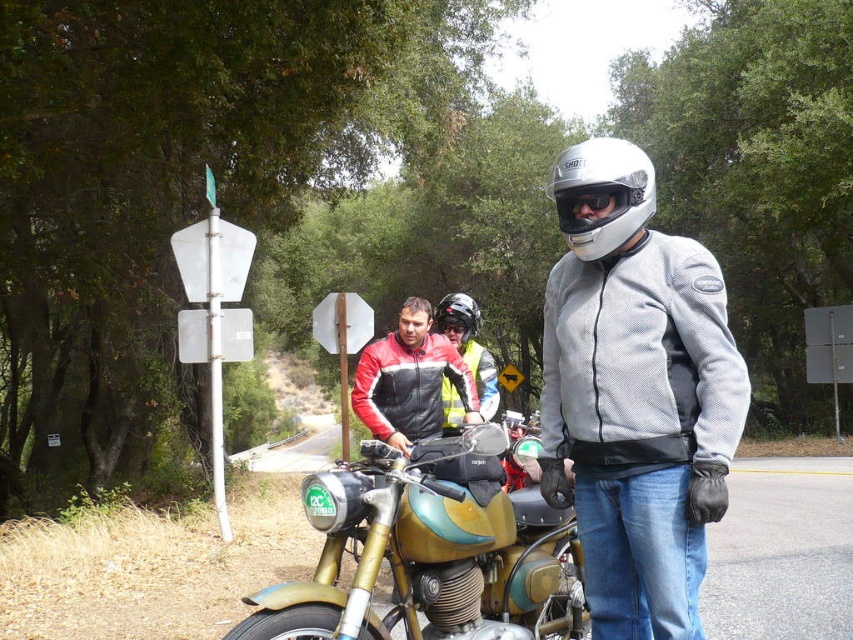
Consider the image. You are standing at the point marked by the coordinates point (451, 452). You want to walk to the nearest road exit, which is located 15 feet away from your current position. Can you reach the exit without exceeding the 15 feet distance?

The point (451, 452) and viewer are 11.17 feet apart. Since 11.17 feet is less than 15 feet, you can reach the exit without exceeding the 15 feet distance.

You are a pedestrian standing at the edge of the road. You see the gold metallic motorcycle at center and the glossy black helmet at center. How far apart are these two objects from each other?

The gold metallic motorcycle at center is 3.00 meters away from the glossy black helmet at center.

Based on the photo, you are a photographer trying to capture the black matte goggles at center in your shot. Given that your camera has a focal point at coordinates 0.5, 0.5, will the goggles be in focus?

The black matte goggles at center are located at coordinates (x=590, y=205), which are not at the camera focal point of (x=426, y=320). Therefore, the goggles will not be in focus.